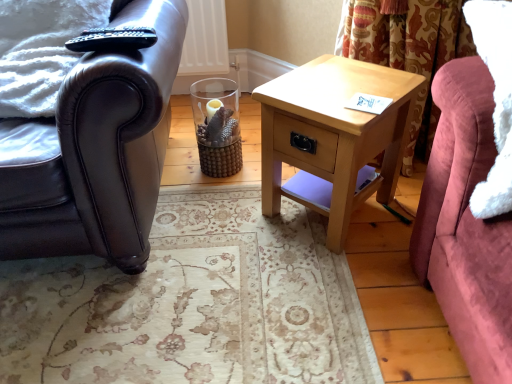
Question: Is light wood/texture nightstand at center behind shiny black leather armchair at left?

Choices:
 (A) yes
 (B) no

Answer: (A)

Question: Is light wood/texture nightstand at center far away from shiny black leather armchair at left?

Choices:
 (A) yes
 (B) no

Answer: (B)

Question: Is light wood/texture nightstand at center positioned with its back to shiny black leather armchair at left?

Choices:
 (A) no
 (B) yes

Answer: (A)

Question: Is light wood/texture nightstand at center shorter than shiny black leather armchair at left?

Choices:
 (A) yes
 (B) no

Answer: (A)

Question: Is shiny black leather armchair at left surrounded by light wood/texture nightstand at center?

Choices:
 (A) yes
 (B) no

Answer: (B)

Question: Based on their sizes in the image, would you say light wood/texture nightstand at center is bigger or smaller than velvet pink couch at right?

Choices:
 (A) big
 (B) small

Answer: (A)

Question: Is light wood/texture nightstand at center inside or outside of velvet pink couch at right?

Choices:
 (A) outside
 (B) inside

Answer: (A)

Question: From the image's perspective, is light wood/texture nightstand at center located above or below velvet pink couch at right?

Choices:
 (A) below
 (B) above

Answer: (A)

Question: Would you say light wood/texture nightstand at center is to the left or to the right of velvet pink couch at right in the picture?

Choices:
 (A) left
 (B) right

Answer: (A)

Question: In terms of width, does shiny black leather armchair at left look wider or thinner when compared to light wood/texture nightstand at center?

Choices:
 (A) thin
 (B) wide

Answer: (B)

Question: From a real-world perspective, is shiny black leather armchair at left above or below light wood/texture nightstand at center?

Choices:
 (A) below
 (B) above

Answer: (B)

Question: Considering the positions of point [86, 94] and point [337, 170], is point [86, 94] closer or farther from the camera than point [337, 170]?

Choices:
 (A) closer
 (B) farther

Answer: (A)

Question: In terms of size, does shiny black leather armchair at left appear bigger or smaller than light wood/texture nightstand at center?

Choices:
 (A) big
 (B) small

Answer: (A)

Question: In the image, is light wood/texture nightstand at center positioned in front of or behind shiny black leather armchair at left?

Choices:
 (A) behind
 (B) front

Answer: (A)

Question: Does point (366, 175) appear closer or farther from the camera than point (132, 67)?

Choices:
 (A) closer
 (B) farther

Answer: (B)